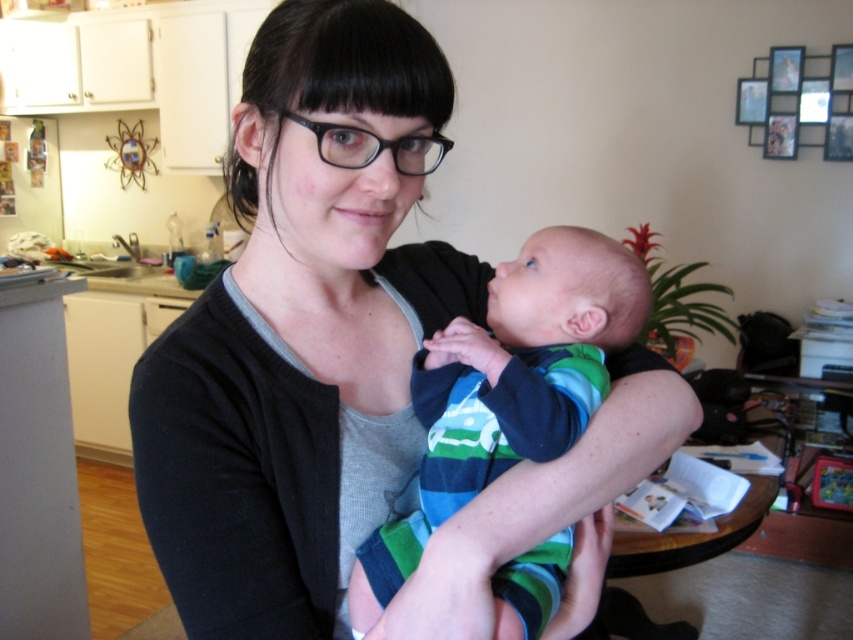
In the scene described, the woman is wearing the black matte cardigan at center and holding the baby in the striped cotton onesie at center. From the observer perspective, which item is positioned more to the left?

The black matte cardigan at center is positioned to the left of the striped cotton onesie at center, so it is more to the left.

You are a photographer trying to capture the perfect shot of the two points in the scene. Which point, point (654, 358) or point (422, 424), will appear larger in your photo?

Point (654, 358) is further to the camera than point (422, 424), so it will appear larger in the photo.

You are a fashion designer observing the scene. You need to determine which clothing item, the black matte cardigan at center or the striped cotton onesie at center, would require more fabric to create a similar design. Based on their sizes in the image, which one would need more fabric?

The black matte cardigan at center is much taller than the striped cotton onesie at center, so it would require more fabric to create a similar design.